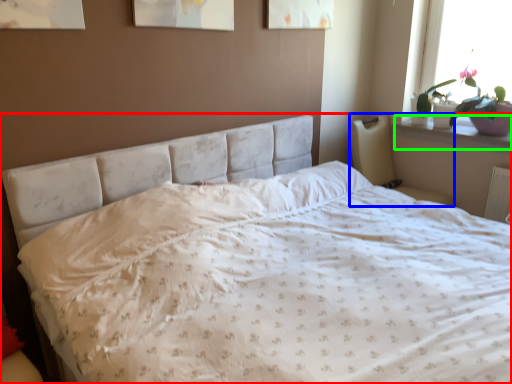
Question: Considering the real-world distances, which object is farthest from bed (highlighted by a red box)? armchair (highlighted by a blue box) or window sill (highlighted by a green box)?

Choices:
 (A) armchair
 (B) window sill

Answer: (B)